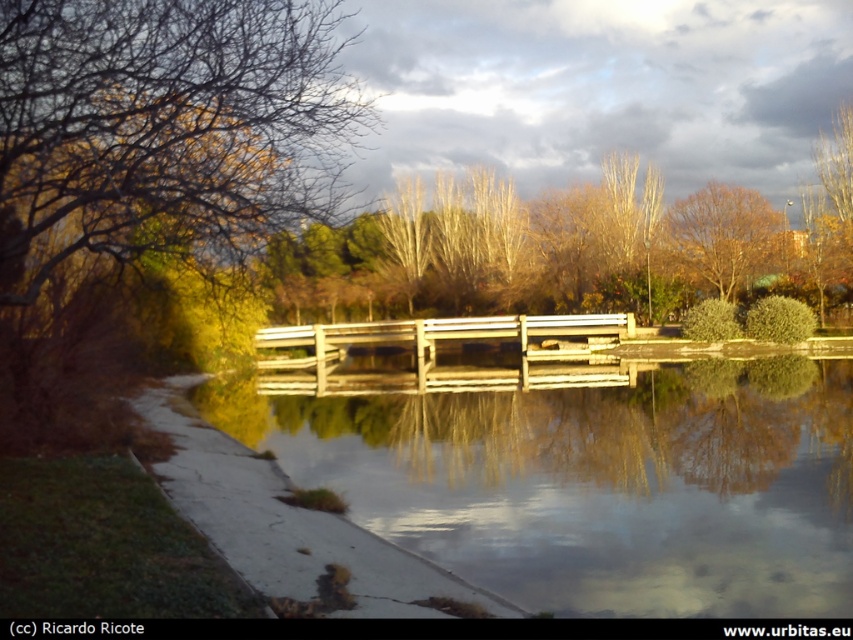
You are a park visitor who wants to take a photo of the transparent water at bridge center and the brown matte tree at upper center. Which object should you focus on first if you want to capture both in a single frame without moving the camera?

You should focus on the brown matte tree at upper center first because it is taller than the transparent water at bridge center, allowing both to fit in the frame more effectively.

You are a park visitor who wants to take a photo of the wooden bridge at center and the brown matte tree at upper center. Which object will appear smaller in the photo?

The wooden bridge at center will appear smaller in the photo because it is shorter than the brown matte tree at upper center.